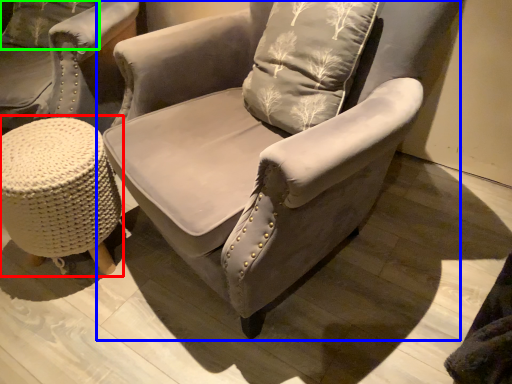
Question: Estimate the real-world distances between objects in this image. Which object is farther from music stool (highlighted by a red box), chair (highlighted by a blue box) or pillow (highlighted by a green box)?

Choices:
 (A) chair
 (B) pillow

Answer: (B)